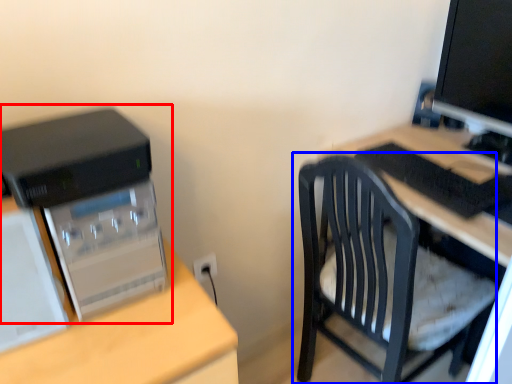
Question: Which object is further to the camera taking this photo, computer tower (highlighted by a red box) or chair (highlighted by a blue box)?

Choices:
 (A) computer tower
 (B) chair

Answer: (B)